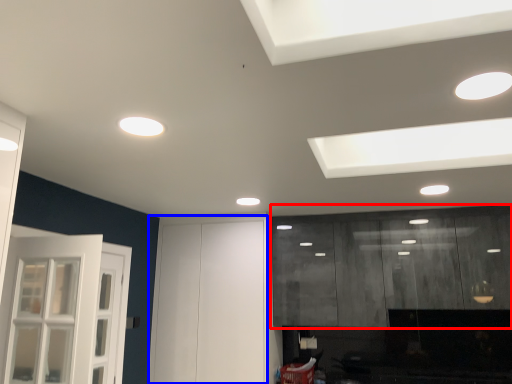
Question: Which of the following is the closest to the observer, cabinetry (highlighted by a red box) or door (highlighted by a blue box)?

Choices:
 (A) cabinetry
 (B) door

Answer: (A)